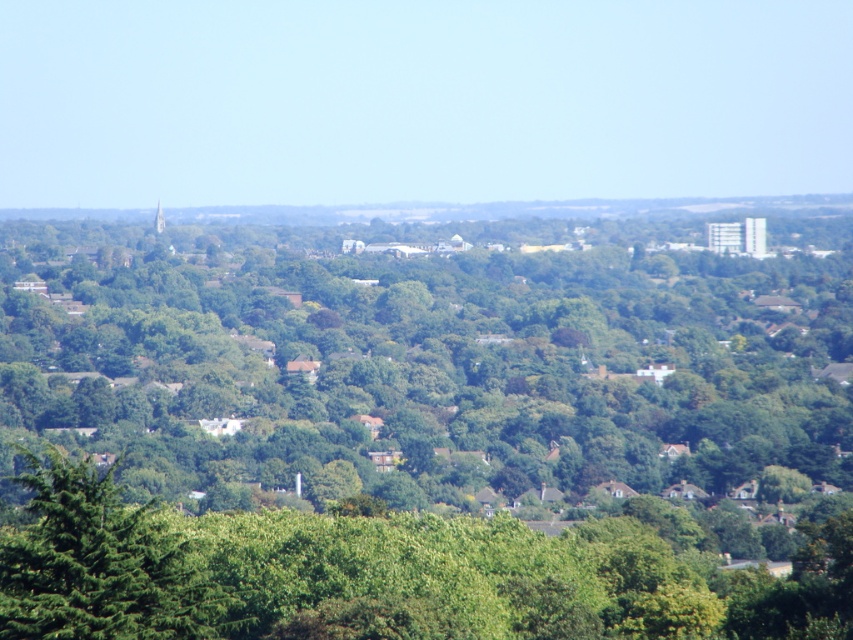
Question: Is green leafy tree at center above green leafy tree at lower left?

Choices:
 (A) no
 (B) yes

Answer: (B)

Question: Which point appears closest to the camera in this image?

Choices:
 (A) (537, 397)
 (B) (39, 545)

Answer: (A)

Question: Can you confirm if green leafy tree at center is smaller than green leafy tree at lower left?

Choices:
 (A) yes
 (B) no

Answer: (B)

Question: Which point is closer to the camera?

Choices:
 (A) (33, 538)
 (B) (463, 314)

Answer: (B)

Question: Is green leafy tree at center thinner than green leafy tree at lower left?

Choices:
 (A) yes
 (B) no

Answer: (B)

Question: Which point is closer to the camera?

Choices:
 (A) (648, 371)
 (B) (135, 577)

Answer: (B)